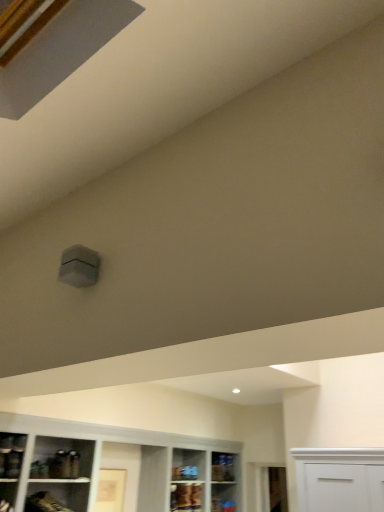
Question: Does matte glass shelf at lower left, the 3th shelf in the bottom-to-top sequence, appear on the left side of clear glass shelf at lower center, marked as the first shelf in a bottom-to-top arrangement?

Choices:
 (A) yes
 (B) no

Answer: (A)

Question: Does matte glass shelf at lower left, the 3th shelf in the bottom-to-top sequence, turn towards clear glass shelf at lower center, placed as the 1th shelf when sorted from right to left?

Choices:
 (A) yes
 (B) no

Answer: (B)

Question: Is matte glass shelf at lower left, marked as the 3th shelf in a right-to-left arrangement, positioned far away from clear glass shelf at lower center, positioned as the 3th shelf in top-to-bottom order?

Choices:
 (A) yes
 (B) no

Answer: (A)

Question: From the image's perspective, would you say matte glass shelf at lower left, acting as the first shelf starting from the top, is positioned over clear glass shelf at lower center, the 1th shelf when ordered from back to front?

Choices:
 (A) no
 (B) yes

Answer: (B)

Question: Is clear glass shelf at lower center, marked as the first shelf in a bottom-to-top arrangement, completely or partially inside matte glass shelf at lower left, which appears as the first shelf when viewed from the left?

Choices:
 (A) yes
 (B) no

Answer: (B)

Question: Is matte glass shelf at lower left, which appears as the first shelf when viewed from the left, next to clear glass shelf at lower center, the 3th shelf when ordered from front to back, and touching it?

Choices:
 (A) no
 (B) yes

Answer: (A)

Question: Can you confirm if clear glass shelf at lower center, the 3th shelf when ordered from front to back, is wider than matte brown shelf at lower left, the second shelf when ordered from front to back?

Choices:
 (A) yes
 (B) no

Answer: (B)

Question: Is clear glass shelf at lower center, the 1th shelf when ordered from back to front, aimed at matte brown shelf at lower left, which is the 2th shelf from bottom to top?

Choices:
 (A) yes
 (B) no

Answer: (B)

Question: From the image's perspective, is clear glass shelf at lower center, placed as the 1th shelf when sorted from right to left, on top of matte brown shelf at lower left, acting as the second shelf starting from the left?

Choices:
 (A) no
 (B) yes

Answer: (A)

Question: Is clear glass shelf at lower center, marked as the first shelf in a bottom-to-top arrangement, behind matte brown shelf at lower left, which is the 2th shelf from bottom to top?

Choices:
 (A) no
 (B) yes

Answer: (B)

Question: Does clear glass shelf at lower center, positioned as the 3th shelf in top-to-bottom order, appear on the right side of matte brown shelf at lower left, acting as the second shelf starting from the left?

Choices:
 (A) yes
 (B) no

Answer: (A)

Question: Is clear glass shelf at lower center, placed as the 1th shelf when sorted from right to left, at the left side of matte brown shelf at lower left, which is the 2th shelf from bottom to top?

Choices:
 (A) yes
 (B) no

Answer: (B)

Question: Is matte brown cabinet at lower center wider than clear glass shelf at lower center, the 3th shelf when ordered from front to back?

Choices:
 (A) yes
 (B) no

Answer: (A)